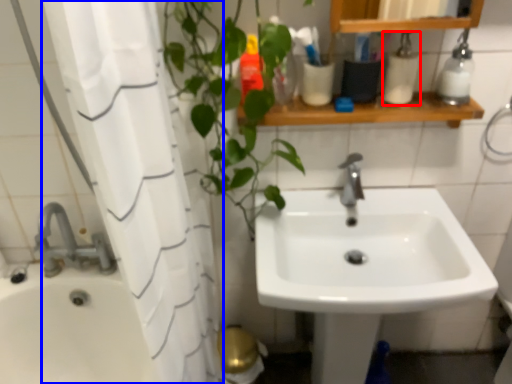
Question: Which point is closer to the camera, toiletry (highlighted by a red box) or shower curtain (highlighted by a blue box)?

Choices:
 (A) toiletry
 (B) shower curtain

Answer: (B)